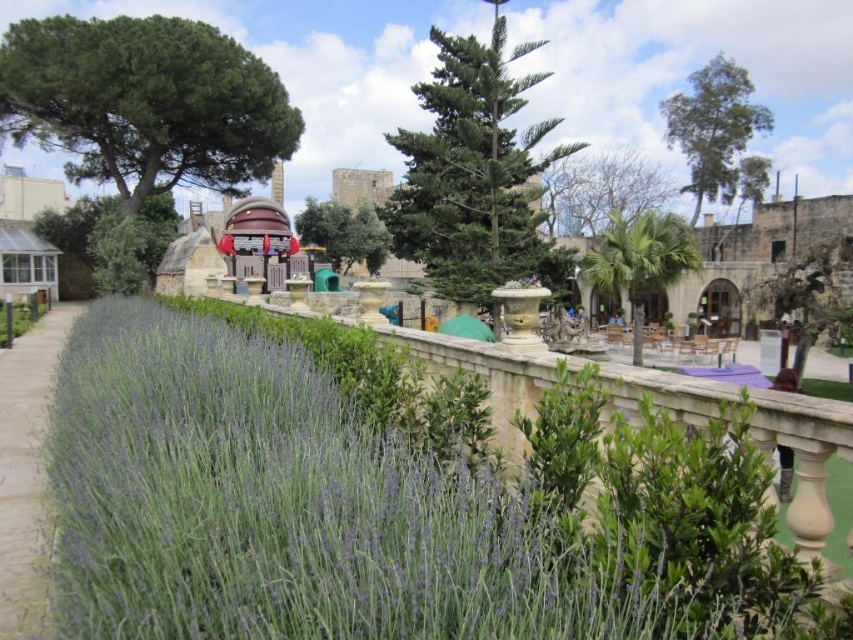
Does green grass at lower left have a greater width compared to green leafy tree at center?

Correct, the width of green grass at lower left exceeds that of green leafy tree at center.

Is point (21, 344) closer to viewer compared to point (335, 227)?

Yes, it is.

Who is more forward, (35, 520) or (317, 204)?

Point (35, 520) is in front.

The height and width of the screenshot is (640, 853). What are the coordinates of `green grass at lower left` in the screenshot? It's located at (26, 470).

Can you confirm if green grass at lower left is positioned to the right of green leafy tree at upper right?

Incorrect, green grass at lower left is not on the right side of green leafy tree at upper right.

Is green grass at lower left bigger than green leafy tree at upper right?

Actually, green grass at lower left might be smaller than green leafy tree at upper right.

At what (x,y) coordinates should I click in order to perform the action: click on green grass at lower left. Please return your answer as a coordinate pair (x, y). This screenshot has width=853, height=640. Looking at the image, I should click on (26, 470).

This screenshot has width=853, height=640. I want to click on green grass at lower left, so click(26, 470).

From the picture: Between green leafy tree at upper left and green leafy tree at center, which one appears on the right side from the viewer's perspective?

green leafy tree at center

This screenshot has width=853, height=640. I want to click on green leafy tree at upper left, so click(x=144, y=102).

Find the location of a particular element. The height and width of the screenshot is (640, 853). green leafy tree at upper left is located at coordinates (144, 102).